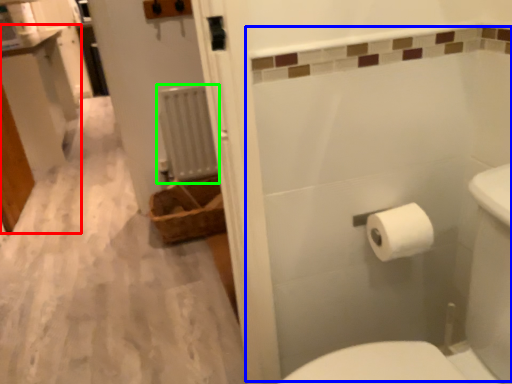
Question: Which object is the farthest from vanity (highlighted by a red box)? Choose among these: bath (highlighted by a blue box) or radiator (highlighted by a green box).

Choices:
 (A) bath
 (B) radiator

Answer: (A)